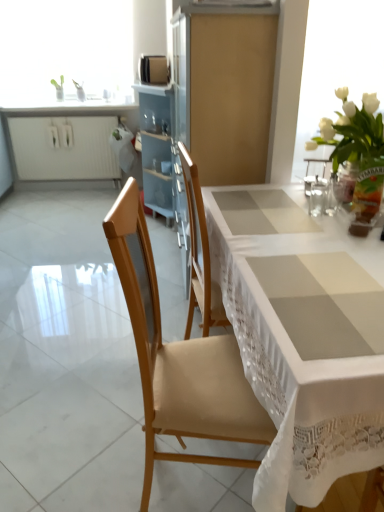
Locate an element on the screen. The height and width of the screenshot is (512, 384). vacant space in front of white matte cabinet at upper left is located at coordinates click(x=59, y=211).